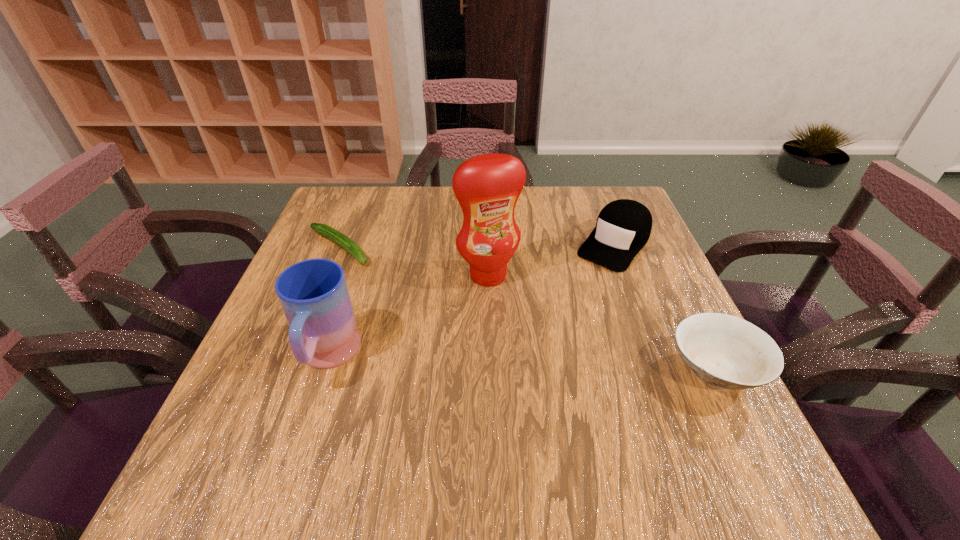
Find the location of `free space on the desktop that is between the fourth shortest object and the fourth tallest object and is positioned on the front-facing side of the zucchini`. free space on the desktop that is between the fourth shortest object and the fourth tallest object and is positioned on the front-facing side of the zucchini is located at coordinates (x=497, y=363).

At what (x,y) coordinates should I click in order to perform the action: click on vacant space on the desktop that is between the mug and the bowl and is positioned on the label side of the third object from left to right. Please return your answer as a coordinate pair (x, y). Looking at the image, I should click on (532, 364).

The width and height of the screenshot is (960, 540). Identify the location of free space on the desktop that is between the fourth shortest object and the second shortest object and is positioned on the front-facing side of the third tallest object. tap(513, 363).